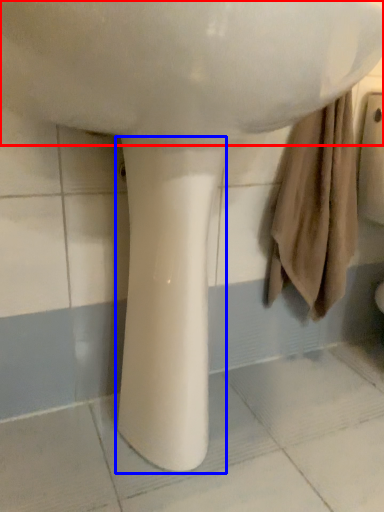
Question: Which point is closer to the camera, sink (highlighted by a red box) or pillar (highlighted by a blue box)?

Choices:
 (A) sink
 (B) pillar

Answer: (A)